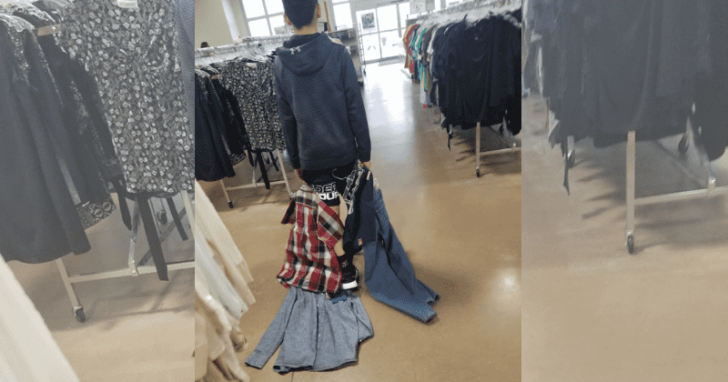
At what (x,y) coordinates should I click in order to perform the action: click on sign on door. Please return your answer as a coordinate pair (x, y). Image resolution: width=728 pixels, height=382 pixels. Looking at the image, I should click on click(368, 22).